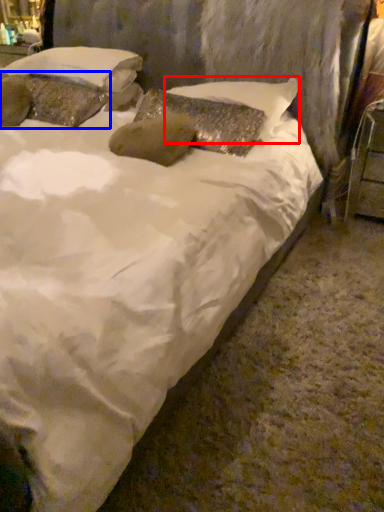
Question: Among these objects, which one is farthest to the camera, pillow (highlighted by a red box) or pillow (highlighted by a blue box)?

Choices:
 (A) pillow
 (B) pillow

Answer: (B)